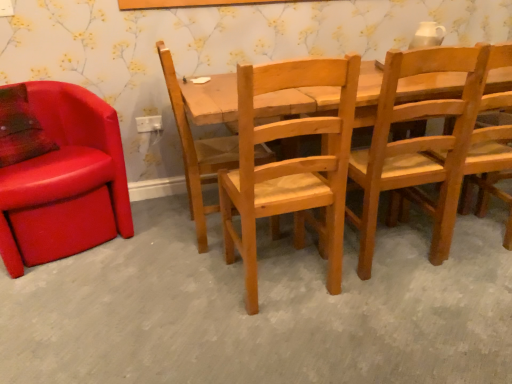
Question: Can you confirm if leather at left, which is the fifth chair in right-to-left order, is thinner than natural wood chair at center, which is the third chair in right-to-left order?

Choices:
 (A) yes
 (B) no

Answer: (B)

Question: From a real-world perspective, is leather at left, which is the fifth chair in right-to-left order, under natural wood chair at center, which is the third chair in right-to-left order?

Choices:
 (A) no
 (B) yes

Answer: (B)

Question: Can you confirm if leather at left, which is the fifth chair in right-to-left order, is positioned to the left of natural wood chair at center, placed as the third chair when sorted from left to right?

Choices:
 (A) no
 (B) yes

Answer: (B)

Question: Considering the relative sizes of leather at left, which appears as the 1th chair when viewed from the left, and natural wood chair at center, which is the third chair in right-to-left order, in the image provided, is leather at left, which appears as the 1th chair when viewed from the left, smaller than natural wood chair at center, which is the third chair in right-to-left order,?

Choices:
 (A) no
 (B) yes

Answer: (A)

Question: Is the position of leather at left, which appears as the 1th chair when viewed from the left, less distant than that of natural wood chair at center, placed as the third chair when sorted from left to right?

Choices:
 (A) no
 (B) yes

Answer: (A)

Question: Considering the positions of wooden chair at center, which is counted as the second chair, starting from the right, and leather at left, which appears as the 1th chair when viewed from the left, in the image, is wooden chair at center, which is counted as the second chair, starting from the right, taller or shorter than leather at left, which appears as the 1th chair when viewed from the left,?

Choices:
 (A) short
 (B) tall

Answer: (B)

Question: In terms of width, does wooden chair at center, positioned as the fourth chair in left-to-right order, look wider or thinner when compared to leather at left, which appears as the 1th chair when viewed from the left?

Choices:
 (A) wide
 (B) thin

Answer: (B)

Question: From a real-world perspective, is wooden chair at center, which is counted as the second chair, starting from the right, physically located above or below leather at left, which is the fifth chair in right-to-left order?

Choices:
 (A) above
 (B) below

Answer: (A)

Question: From the image's perspective, relative to leather at left, which appears as the 1th chair when viewed from the left, is wooden chair at center, positioned as the fourth chair in left-to-right order, above or below?

Choices:
 (A) above
 (B) below

Answer: (A)

Question: From a real-world perspective, is natural wood chair at center, the 2th chair viewed from the left, positioned above or below natural wood chair at center, which is the third chair in right-to-left order?

Choices:
 (A) above
 (B) below

Answer: (A)

Question: Is natural wood chair at center, which appears as the fourth chair when viewed from the right, inside or outside of natural wood chair at center, placed as the third chair when sorted from left to right?

Choices:
 (A) inside
 (B) outside

Answer: (B)

Question: Looking at their shapes, would you say natural wood chair at center, which appears as the fourth chair when viewed from the right, is wider or thinner than natural wood chair at center, which is the third chair in right-to-left order?

Choices:
 (A) thin
 (B) wide

Answer: (B)

Question: Based on their positions, is natural wood chair at center, the 2th chair viewed from the left, located to the left or right of natural wood chair at center, which is the third chair in right-to-left order?

Choices:
 (A) right
 (B) left

Answer: (B)

Question: From the image's perspective, is natural wood chair at center, which is the third chair in right-to-left order, above or below wooden chair at center, which is counted as the second chair, starting from the right?

Choices:
 (A) above
 (B) below

Answer: (B)

Question: Choose the correct answer: Is natural wood chair at center, placed as the third chair when sorted from left to right, inside wooden chair at center, which is counted as the second chair, starting from the right, or outside it?

Choices:
 (A) inside
 (B) outside

Answer: (B)